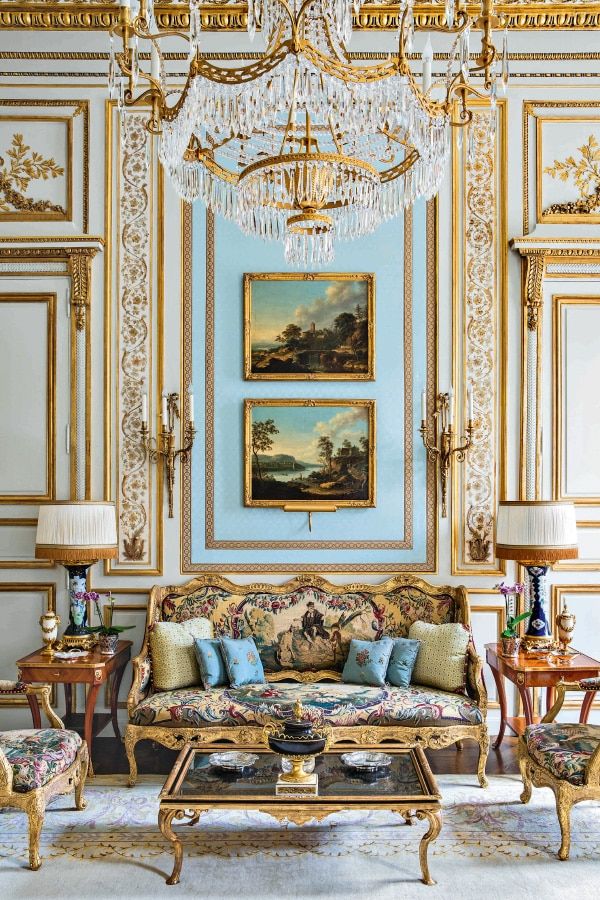
Where is `end tables`? This screenshot has width=600, height=900. end tables is located at coordinates (537, 662), (89, 664).